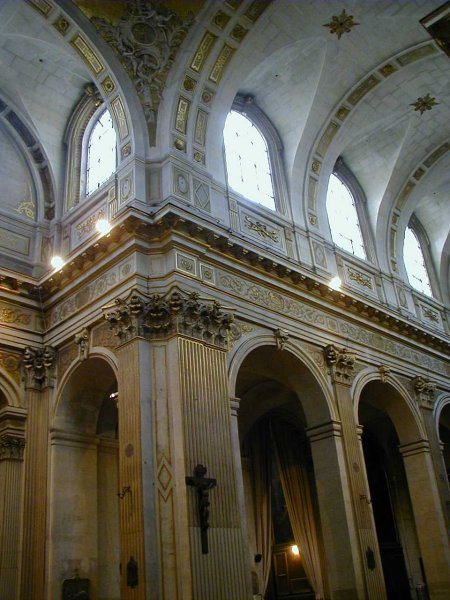
Where is `painting`? This screenshot has width=450, height=600. painting is located at coordinates (280, 510).